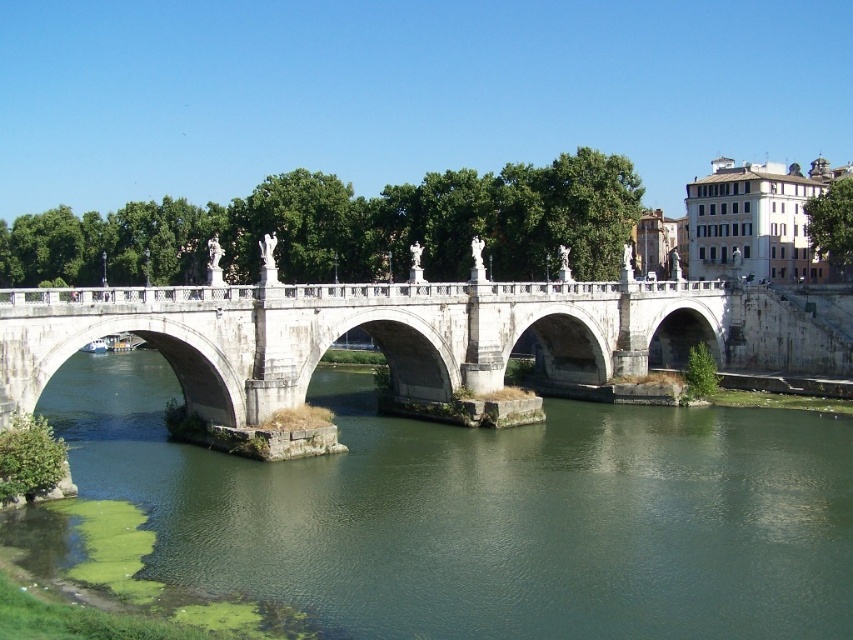
Is point (733, 593) in front of point (488, 380)?

Yes, point (733, 593) is closer to viewer.

Where is `green algae water at lower left`? green algae water at lower left is located at coordinates (489, 515).

Identify the location of green algae water at lower left. (489, 515).